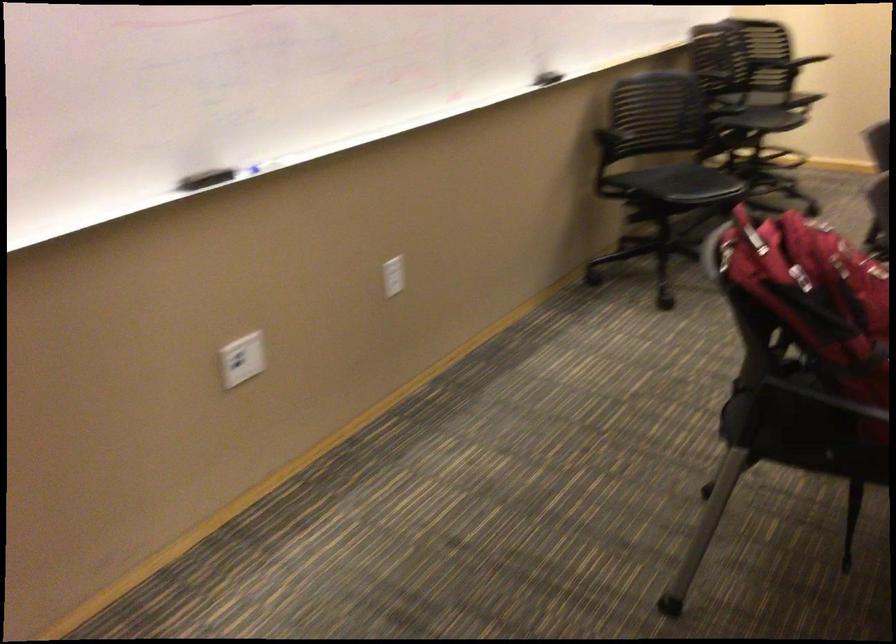
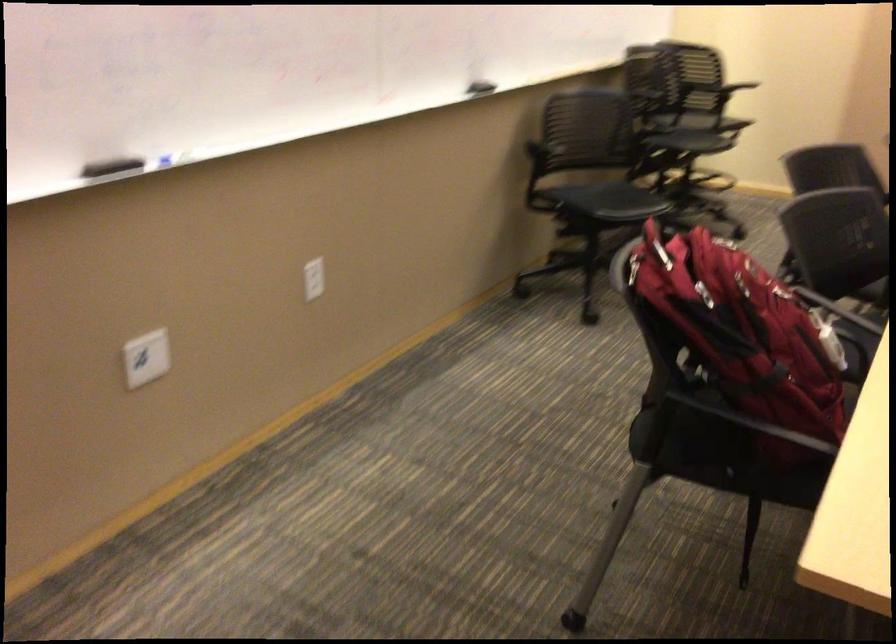
Question: The first image is from the beginning of the video and the second image is from the end. How did the camera likely rotate when shooting the video?

Choices:
 (A) Left
 (B) Right
 (C) Up
 (D) Down

Answer: (B)